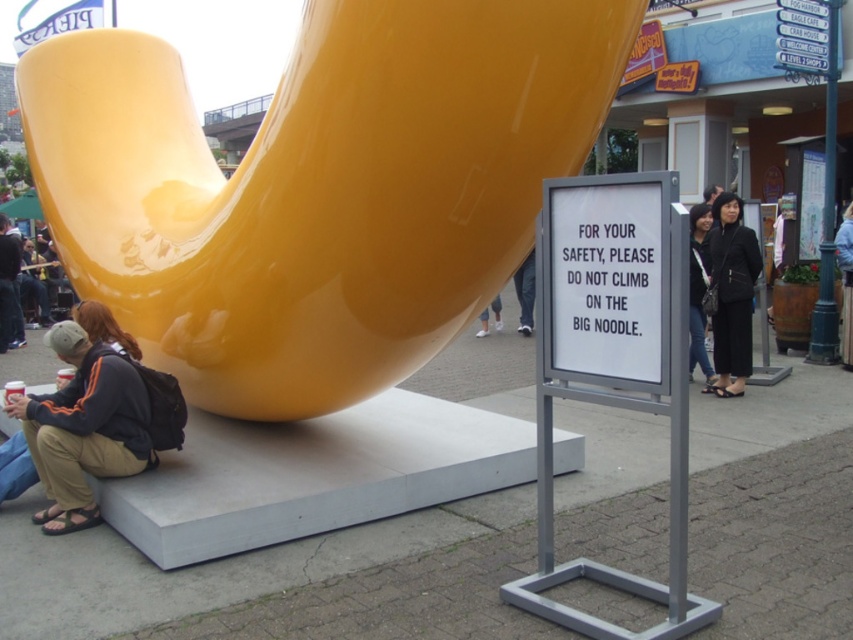
You are a safety inspector visiting the public space where the glossy yellow slide at center and the black fabric pants at right are located. Your task is to ensure that the slide is not being misused. Based on the scene description, what potential safety concern should you address immediately?

The glossy yellow slide at center has a larger size compared to black fabric pants at right, which might encourage people to climb on it, violating the safety sign. You should address the misuse of the slide as a climbing structure.